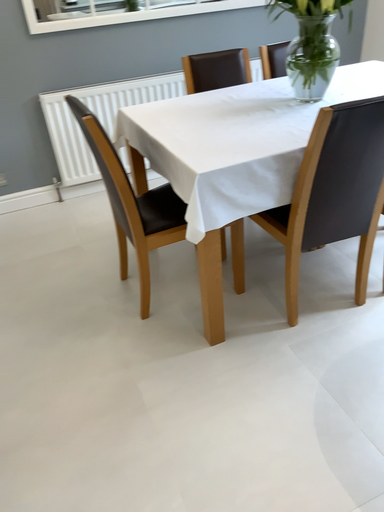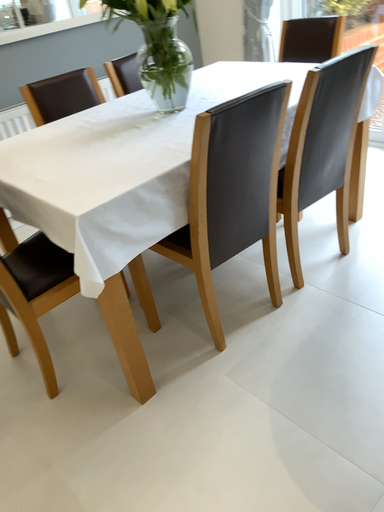
Question: Which way did the camera rotate in the video?

Choices:
 (A) rotated right
 (B) rotated left

Answer: (A)